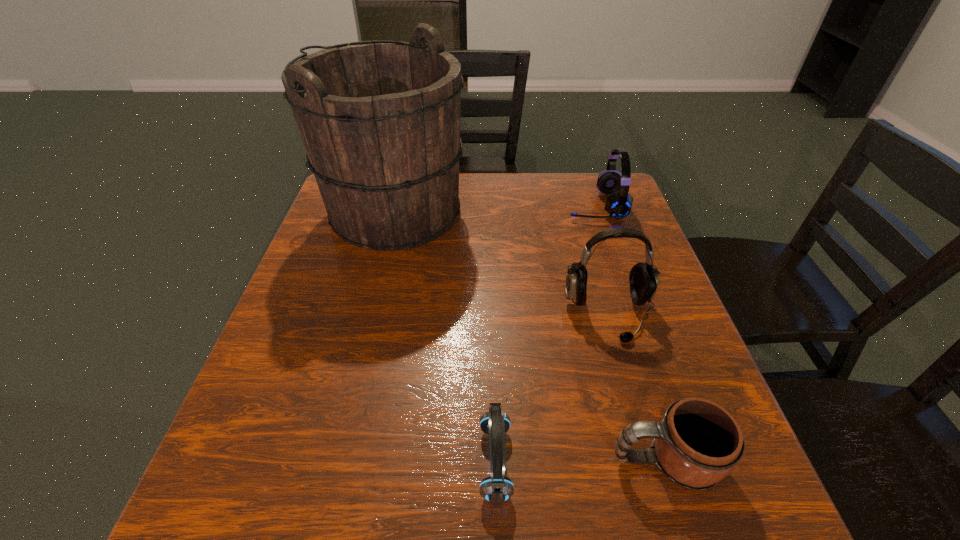
Identify which object is the second nearest to the mug. Please provide its 2D coordinates. Your answer should be formatted as a tuple, i.e. [(x, y)], where the tuple contains the x and y coordinates of a point satisfying the conditions above.

[(643, 279)]

Identify which object is the third nearest to the fourth shortest object. Please provide its 2D coordinates. Your answer should be formatted as a tuple, i.e. [(x, y)], where the tuple contains the x and y coordinates of a point satisfying the conditions above.

[(380, 120)]

Point out which headset is positioned as the second nearest to the farthest headset. Please provide its 2D coordinates. Your answer should be formatted as a tuple, i.e. [(x, y)], where the tuple contains the x and y coordinates of a point satisfying the conditions above.

[(496, 489)]

Identify which headset is the nearest to the third tallest object. Please provide its 2D coordinates. Your answer should be formatted as a tuple, i.e. [(x, y)], where the tuple contains the x and y coordinates of a point satisfying the conditions above.

[(643, 279)]

Identify the location of vacant space that satisfies the following two spatial constraints: 1. with the microphone on the side of the second nearest headset; 2. on the ear cups of the leftmost headset. This screenshot has width=960, height=540. (651, 462).

Locate an element on the screen. vacant space that satisfies the following two spatial constraints: 1. with the microphone on the side of the tallest headset; 2. on the ear cups of the leftmost headset is located at coordinates (651, 462).

Find the location of a particular element. This screenshot has width=960, height=540. blank area in the image that satisfies the following two spatial constraints: 1. with the microphone on the side of the third nearest object; 2. on the ear cups of the second object from left to right is located at coordinates (651, 462).